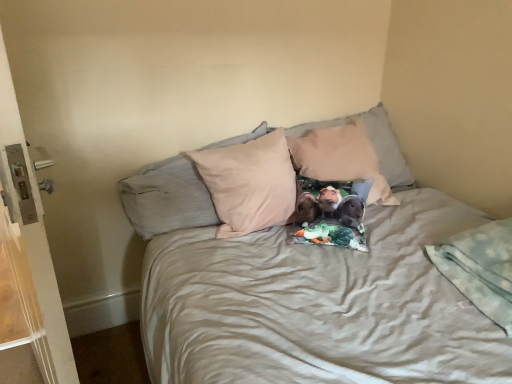
Question: Is white plastic screen door at left smaller than light blue fleece blanket at lower right?

Choices:
 (A) yes
 (B) no

Answer: (B)

Question: Is white plastic screen door at left taller than light blue fleece blanket at lower right?

Choices:
 (A) yes
 (B) no

Answer: (A)

Question: Can you confirm if white plastic screen door at left is wider than light blue fleece blanket at lower right?

Choices:
 (A) yes
 (B) no

Answer: (B)

Question: Does white plastic screen door at left have a lesser height compared to light blue fleece blanket at lower right?

Choices:
 (A) yes
 (B) no

Answer: (B)

Question: Is white plastic screen door at left at the left side of light blue fleece blanket at lower right?

Choices:
 (A) no
 (B) yes

Answer: (B)

Question: From the image's perspective, is white plastic screen door at left above light blue fleece blanket at lower right?

Choices:
 (A) no
 (B) yes

Answer: (B)

Question: Is beige fabric pillow at center, the 2th pillow from the left, a part of light blue fleece blanket at lower right?

Choices:
 (A) yes
 (B) no

Answer: (B)

Question: Does light blue fleece blanket at lower right have a smaller size compared to beige fabric pillow at center, the 2th pillow from the left?

Choices:
 (A) yes
 (B) no

Answer: (A)

Question: Considering the relative positions of light blue fleece blanket at lower right and beige fabric pillow at center, the 2th pillow from the left, in the image provided, is light blue fleece blanket at lower right to the left of beige fabric pillow at center, the 2th pillow from the left, from the viewer's perspective?

Choices:
 (A) yes
 (B) no

Answer: (B)

Question: Is light blue fleece blanket at lower right oriented towards beige fabric pillow at center, the first pillow when ordered from right to left?

Choices:
 (A) no
 (B) yes

Answer: (A)

Question: From the image's perspective, does light blue fleece blanket at lower right appear higher than beige fabric pillow at center, the first pillow when ordered from right to left?

Choices:
 (A) no
 (B) yes

Answer: (A)

Question: Is light blue fleece blanket at lower right located outside beige fabric pillow at center, the 2th pillow from the left?

Choices:
 (A) yes
 (B) no

Answer: (A)

Question: From a real-world perspective, is beige fabric pillow at center, positioned as the first pillow in left-to-right order, positioned under beige fabric pillow at center, the 2th pillow from the left, based on gravity?

Choices:
 (A) no
 (B) yes

Answer: (B)